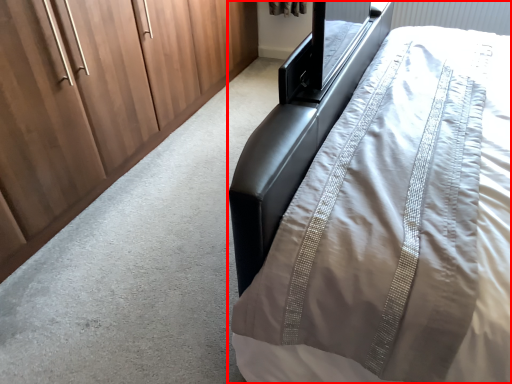
Question: From the image's perspective, considering the relative positions of bed (annotated by the red box) and cupboard in the image provided, where is bed (annotated by the red box) located with respect to the staircase?

Choices:
 (A) above
 (B) below

Answer: (B)